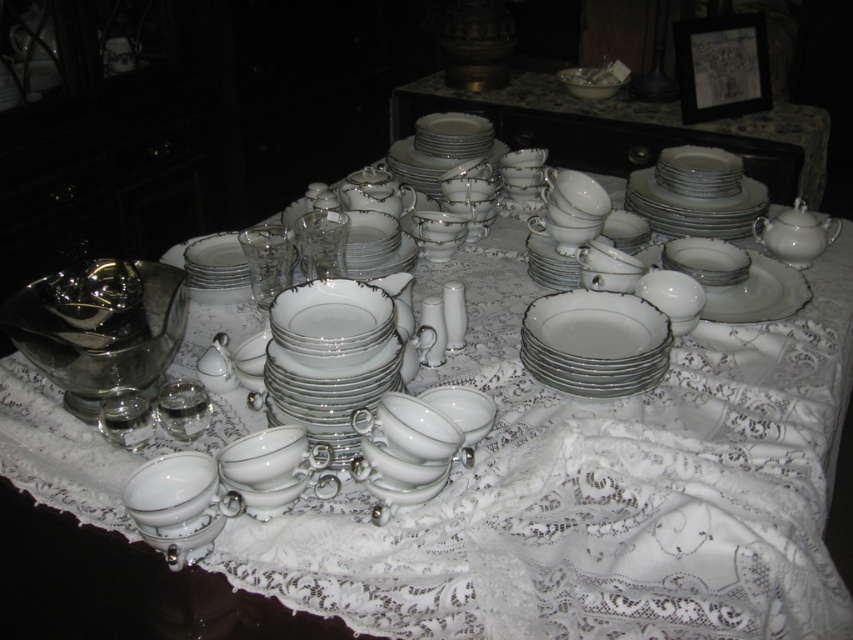
You are setting up a table for a formal dinner and notice the white porcelain plates at upper center and the white porcelain plate at center. Which plate is placed above the other?

The white porcelain plates at upper center is positioned over white porcelain plate at center.

You are setting up a display and need to stack the white porcelain plates at upper center and the white porcelain plate at center vertically. Which plate should you place at the bottom to ensure stability?

The white porcelain plates at upper center should be placed at the bottom because they are taller than the white porcelain plate at center, providing a stable base for the stack.